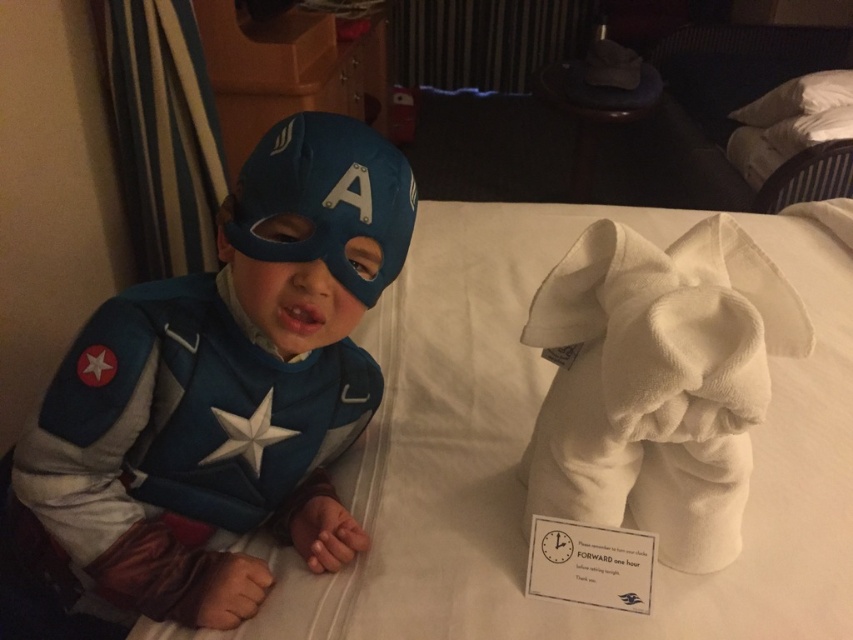
Question: Which point is farther from the camera taking this photo?

Choices:
 (A) 276,518
 (B) 836,96

Answer: (B)

Question: Is blue fabric costume at left further to the viewer compared to white soft pillow at upper right?

Choices:
 (A) no
 (B) yes

Answer: (A)

Question: Is blue fabric costume at left above white soft pillow at upper right?

Choices:
 (A) yes
 (B) no

Answer: (B)

Question: Does blue fabric costume at left appear under white soft pillow at upper right?

Choices:
 (A) no
 (B) yes

Answer: (B)

Question: Which point appears closest to the camera in this image?

Choices:
 (A) (801, 90)
 (B) (180, 384)

Answer: (B)